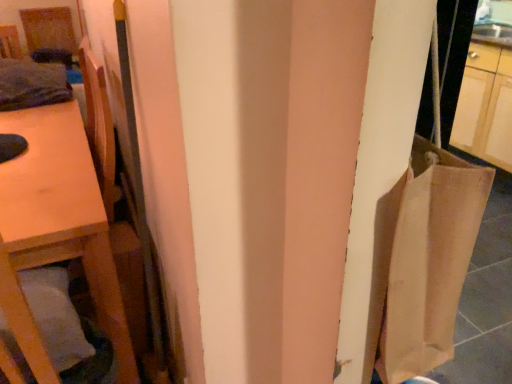
I want to click on wooden chair at left, so click(x=114, y=198).

The height and width of the screenshot is (384, 512). Describe the element at coordinates (55, 316) in the screenshot. I see `white soft pillow at lower left` at that location.

At what (x,y) coordinates should I click in order to perform the action: click on white soft pillow at lower left. Please return your answer as a coordinate pair (x, y). This screenshot has height=384, width=512. Looking at the image, I should click on (55, 316).

The image size is (512, 384). Describe the element at coordinates (56, 228) in the screenshot. I see `wooden table at left` at that location.

Identify the location of wooden chair at left. (114, 198).

Considering the sizes of objects white soft pillow at lower left and wooden chair at left in the image provided, who is thinner, white soft pillow at lower left or wooden chair at left?

wooden chair at left.

From the image's perspective, is white soft pillow at lower left located above wooden chair at left?

No.

Does white soft pillow at lower left touch wooden chair at left?

No, white soft pillow at lower left is not in contact with wooden chair at left.

At what (x,y) coordinates should I click in order to perform the action: click on pillow on the left of the wooden chair at left. Please return your answer as a coordinate pair (x, y). Looking at the image, I should click on pos(55,316).

In the scene shown: Is wooden table at left aimed at white soft pillow at lower left?

No, wooden table at left is not oriented towards white soft pillow at lower left.

Is wooden table at left taller than white soft pillow at lower left?

Yes.

Can you tell me how much wooden table at left and white soft pillow at lower left differ in facing direction?

79.1 degrees.

Can you confirm if wooden chair at left is shorter than white soft pillow at lower left?

In fact, wooden chair at left may be taller than white soft pillow at lower left.

Is wooden chair at left oriented away from white soft pillow at lower left?

That's not correct — wooden chair at left is not looking away from white soft pillow at lower left.

Does point (143, 317) appear closer or farther from the camera than point (40, 299)?

Point (143, 317).

Does point (51, 248) appear closer or farther from the camera than point (82, 52)?

Clearly, point (51, 248) is closer to the camera than point (82, 52).

Can wooden chair at left be found inside wooden table at left?

Definitely not — wooden chair at left is not inside wooden table at left.

Is wooden table at left next to wooden chair at left?

No, wooden table at left is not in contact with wooden chair at left.

Identify the location of furniture to the left of wooden chair at left. The width and height of the screenshot is (512, 384). (56, 228).

Between white soft pillow at lower left and wooden table at left, which one has smaller width?

With smaller width is white soft pillow at lower left.

Is white soft pillow at lower left inside or outside of wooden table at left?

white soft pillow at lower left is inside wooden table at left.

I want to click on pillow in front of the wooden table at left, so click(x=55, y=316).

Is the surface of white soft pillow at lower left in direct contact with wooden table at left?

No, white soft pillow at lower left is not making contact with wooden table at left.

From a real-world perspective, is wooden chair at left positioned above or below wooden table at left?

In terms of real-world spatial position, wooden chair at left is above wooden table at left.

Is wooden chair at left looking in the opposite direction of wooden table at left?

wooden chair at left does not have its back to wooden table at left.

In the image, there is a wooden chair at left. At what (x,y) coordinates should I click in order to perform the action: click on furniture below it (from the image's perspective). Please return your answer as a coordinate pair (x, y). The height and width of the screenshot is (384, 512). Looking at the image, I should click on click(x=56, y=228).

From their relative heights in the image, would you say wooden chair at left is taller or shorter than wooden table at left?

Clearly, wooden chair at left is taller compared to wooden table at left.

You are a GUI agent. You are given a task and a screenshot of the screen. Output one action in this format:
    pyautogui.click(x=<x>, y=<y>)
    Task: Click on the pillow lying in front of the wooden chair at left
    The height and width of the screenshot is (384, 512).
    Given the screenshot: What is the action you would take?
    pyautogui.click(x=55, y=316)

At what (x,y) coordinates should I click in order to perform the action: click on pillow above the wooden table at left (from a real-world perspective). Please return your answer as a coordinate pair (x, y). This screenshot has width=512, height=384. Looking at the image, I should click on (55, 316).

Looking at the image, which one is located closer to wooden chair at left, white soft pillow at lower left or wooden table at left?

Based on the image, wooden table at left appears to be nearer to wooden chair at left.

From the image, which object appears to be farther from wooden table at left, wooden chair at left or white soft pillow at lower left?

Based on the image, white soft pillow at lower left appears to be further to wooden table at left.

When comparing their distances from wooden table at left, does white soft pillow at lower left or wooden chair at left seem closer?

The object closer to wooden table at left is wooden chair at left.

Which object lies nearer to the anchor point white soft pillow at lower left, wooden table at left or wooden chair at left?

wooden table at left is closer to white soft pillow at lower left.

In the scene shown: From the image, which object appears to be nearer to wooden chair at left, wooden table at left or white soft pillow at lower left?

wooden table at left.

Considering their positions, is wooden chair at left positioned closer to white soft pillow at lower left than wooden table at left?

The object closer to white soft pillow at lower left is wooden table at left.

In order to click on pillow between wooden table at left and wooden chair at left from left to right in this screenshot , I will do `click(55, 316)`.